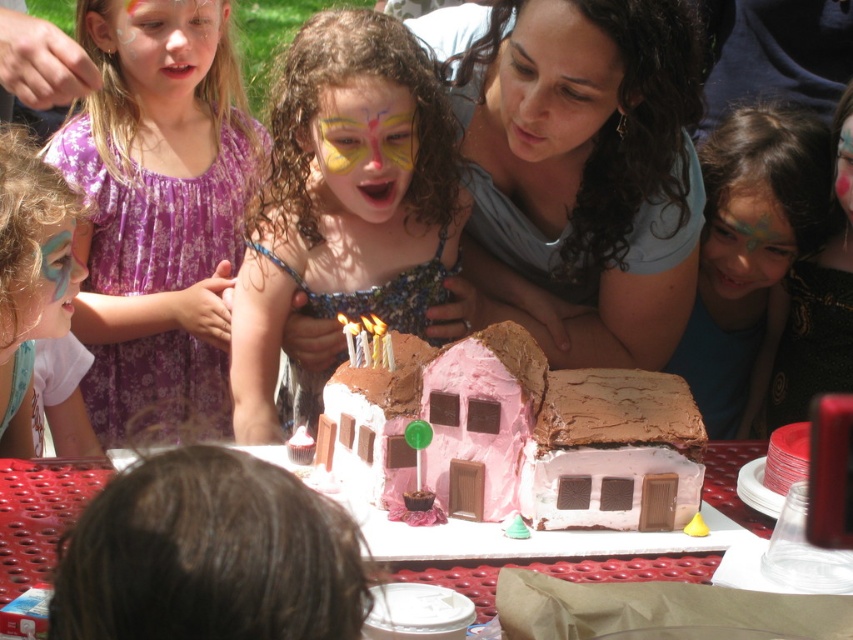
You are a photographer at this birthday party. You want to take a photo of the two subjects, the matte purple dress at left and the pastel blue face paint at lower right. The minimum distance your camera can focus clearly is 1.5 meters. Will both subjects be in focus if you take the photo from where you are standing?

The matte purple dress at left is 1.41 meters from the pastel blue face paint at lower right. Since the distance between them is less than the camera minimum focus distance of 1.5 meters, the two subjects will not both be in focus in the photo.